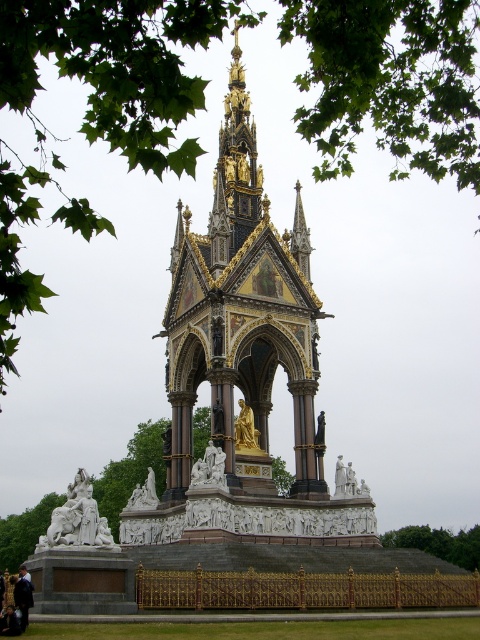
Question: Among these points, which one is farthest from the camera?

Choices:
 (A) (204, 259)
 (B) (408, 529)
 (C) (85, 502)
 (D) (263, 12)

Answer: (B)

Question: Does green leafy tree at upper center have a smaller size compared to gold/gilded stone tower at center?

Choices:
 (A) yes
 (B) no

Answer: (B)

Question: Can you confirm if white marble sculpture at lower left is smaller than white marble statue at center?

Choices:
 (A) yes
 (B) no

Answer: (B)

Question: Which point is closer to the camera?

Choices:
 (A) (218, 452)
 (B) (241, 166)
 (C) (479, 566)

Answer: (A)

Question: Among these points, which one is nearest to the camera?

Choices:
 (A) (170, 396)
 (B) (72, 541)

Answer: (B)

Question: Does gold/gilded stone tower at center appear under white marble statue at center?

Choices:
 (A) no
 (B) yes

Answer: (A)